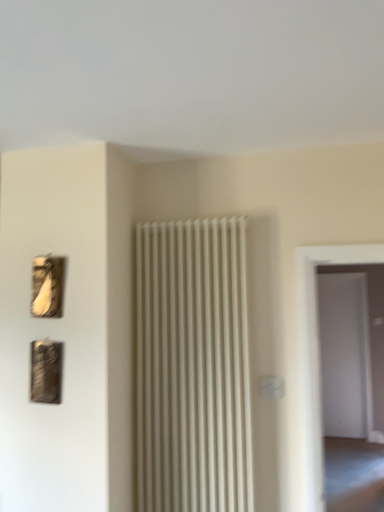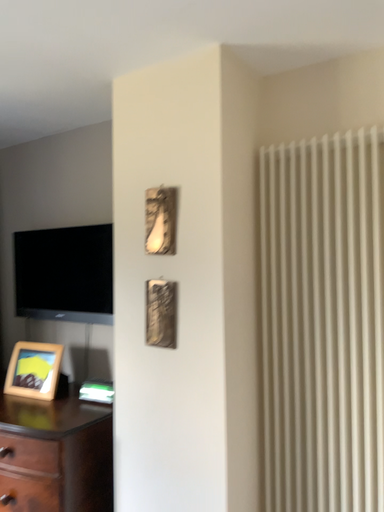
Question: Which way did the camera rotate in the video?

Choices:
 (A) rotated left
 (B) rotated right

Answer: (A)